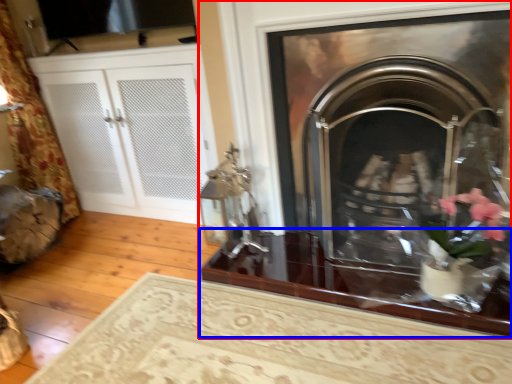
Question: Which point is further to the camera, fireplace (highlighted by a red box) or table (highlighted by a blue box)?

Choices:
 (A) fireplace
 (B) table

Answer: (B)